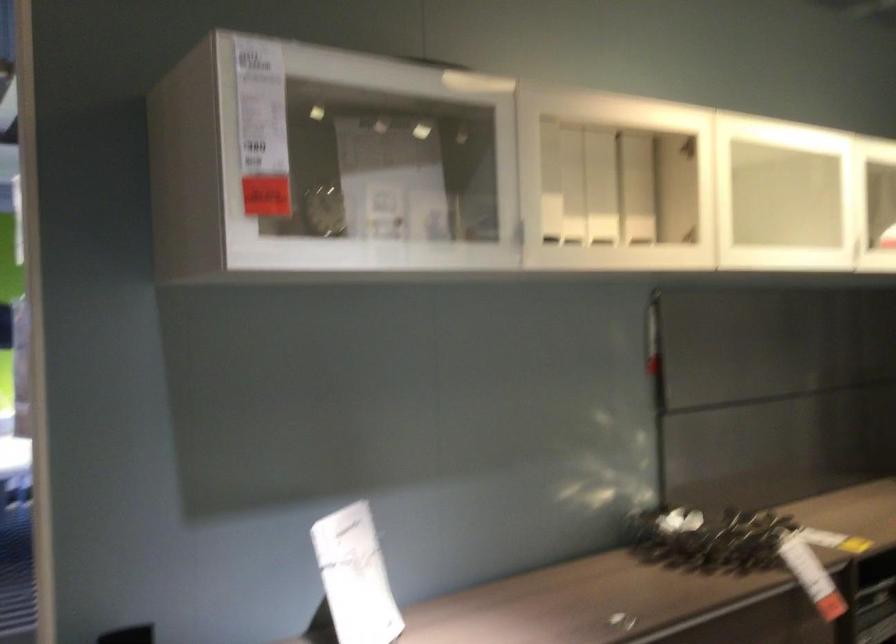
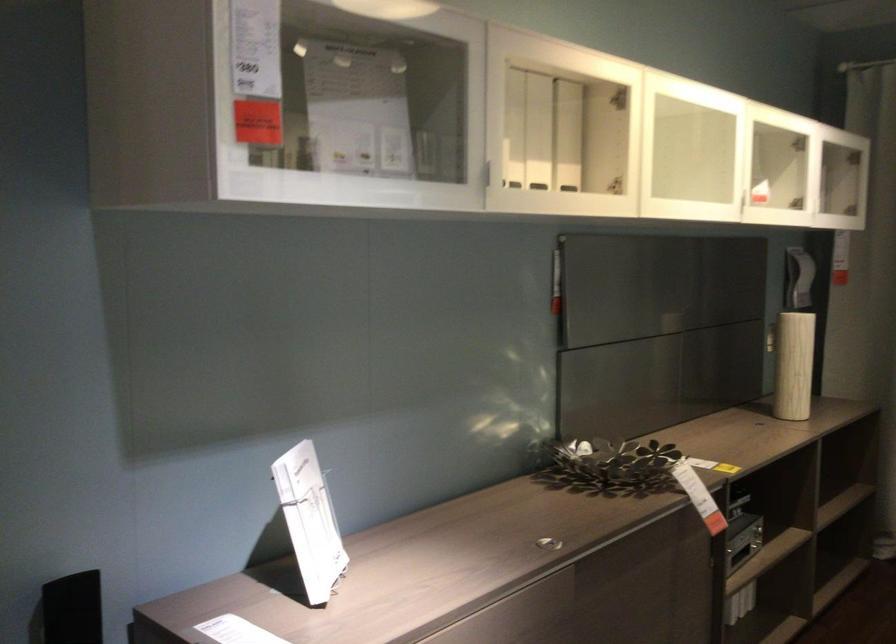
Where in the second image is the point corresponding to (635,187) from the first image?

(567, 135)